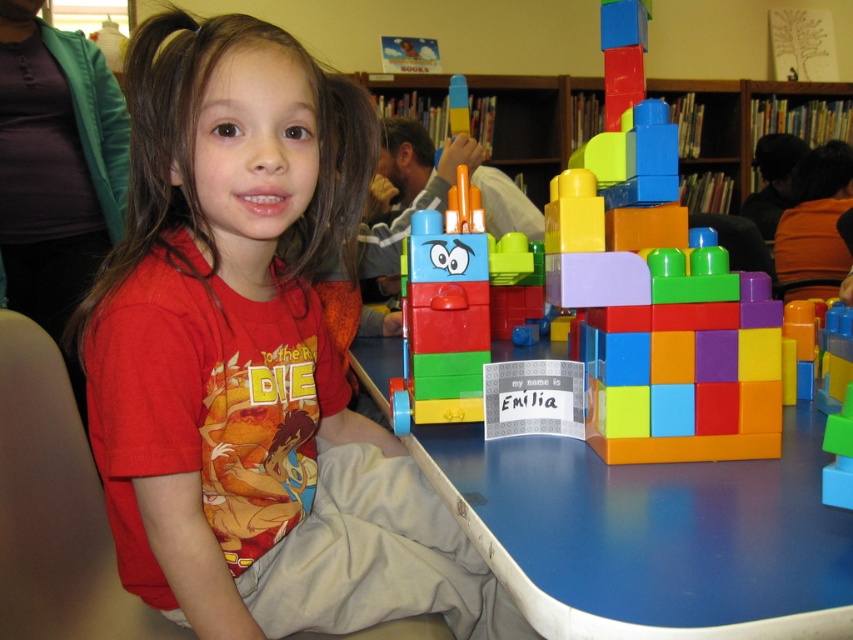
Based on the photo, you are a parent who wants to ensure the blue plastic table at center can support the multicolored plastic blocks at center without tipping over. Based on their sizes, do you think the table is stable enough?

The blue plastic table at center is shorter than multicolored plastic blocks at center, which might make it less stable. The height difference could cause the blocks to be top heavy, increasing the risk of tipping.

You are standing in front of the table where the girl is building with blocks. There are two points marked on the table surface. One is at coordinate point [335,547] and the other is at point [836,515]. Which point is closer to you?

Point [335,547] is closer to you because it is further to the camera than point [836,515].